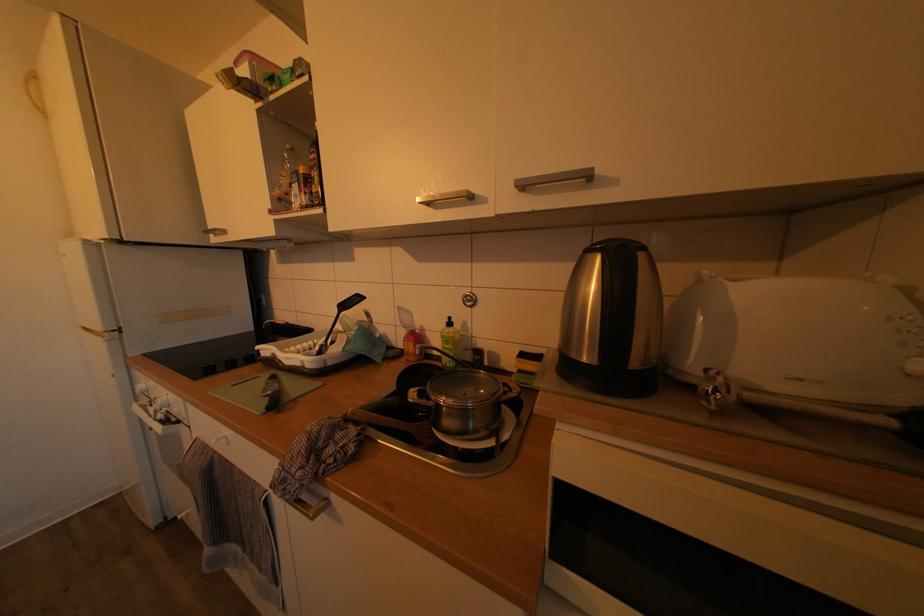
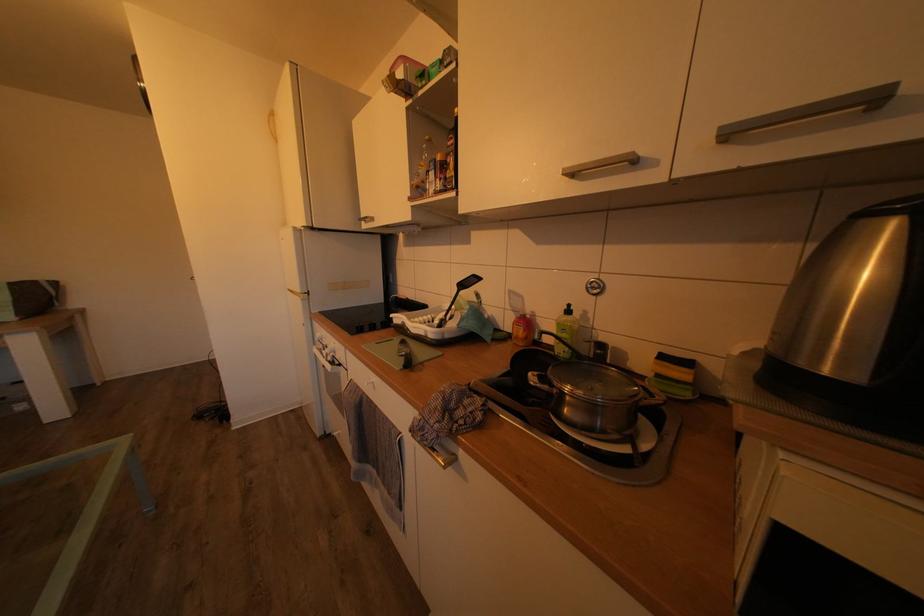
In the second image, find the point that corresponds to pixel 528 377 in the first image.

(666, 382)